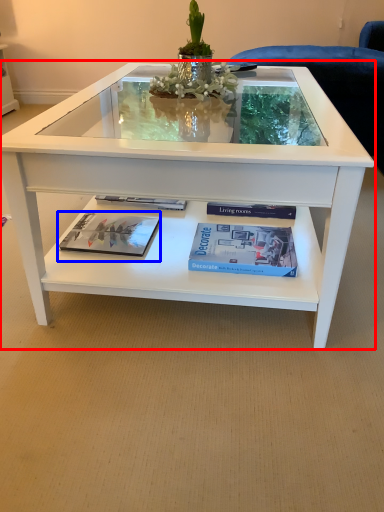
Question: Among these objects, which one is nearest to the camera, coffee table (highlighted by a red box) or magazine (highlighted by a blue box)?

Choices:
 (A) coffee table
 (B) magazine

Answer: (A)